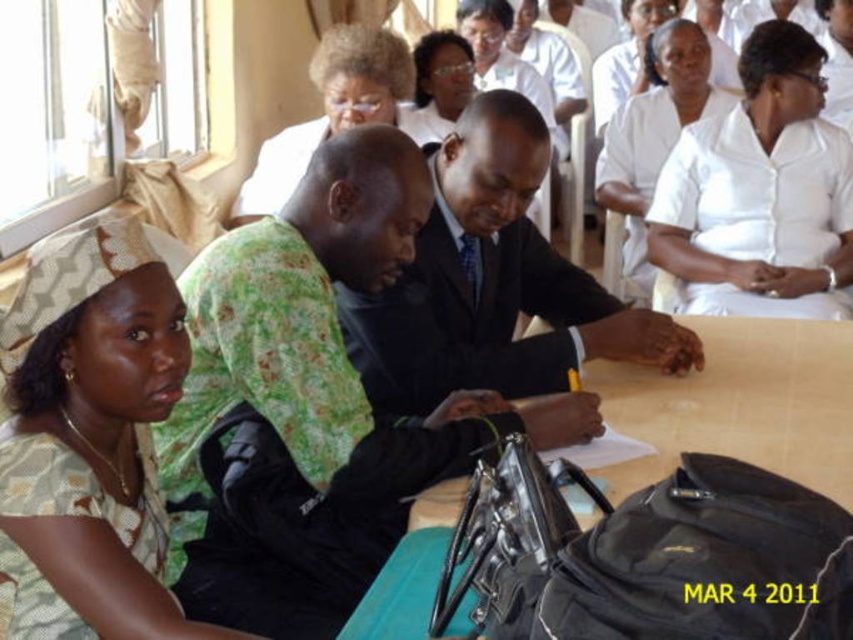
Which is behind, point (750, 157) or point (669, 388)?

Positioned behind is point (750, 157).

What are the coordinates of `white smooth blouse at upper center` in the screenshot? It's located at (759, 193).

Measure the distance between point (48, 454) and camera.

A distance of 1.22 meters exists between point (48, 454) and camera.

Can you confirm if patterned fabric headscarf at lower left is positioned above white smooth shirt at upper center?

Incorrect, patterned fabric headscarf at lower left is not positioned above white smooth shirt at upper center.

Locate an element on the screen. The width and height of the screenshot is (853, 640). patterned fabric headscarf at lower left is located at coordinates (x=90, y=442).

Where is `patterned fabric headscarf at lower left`? patterned fabric headscarf at lower left is located at coordinates (90, 442).

Measure the distance from green printed shirt at center to white smooth blouse at upper center.

5.28 feet

Looking at this image, does green printed shirt at center have a lesser width compared to white smooth blouse at upper center?

No.

What do you see at coordinates (312, 403) in the screenshot? The image size is (853, 640). I see `green printed shirt at center` at bounding box center [312, 403].

Where is `green printed shirt at center`? Image resolution: width=853 pixels, height=640 pixels. green printed shirt at center is located at coordinates (312, 403).